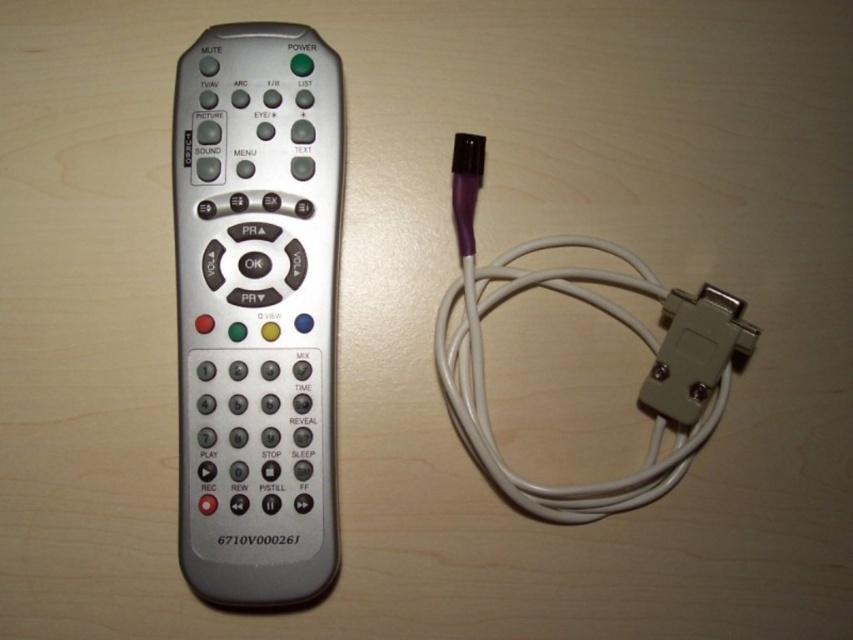
Question: Is silver metallic remote at left below white rubber cable at right?

Choices:
 (A) yes
 (B) no

Answer: (B)

Question: Which of the following is the closest to the observer?

Choices:
 (A) white rubber cable at right
 (B) silver metallic remote at left

Answer: (B)

Question: Is silver metallic remote at left closer to the viewer compared to white rubber cable at right?

Choices:
 (A) yes
 (B) no

Answer: (A)

Question: In this image, where is silver metallic remote at left located relative to white rubber cable at right?

Choices:
 (A) above
 (B) below

Answer: (A)